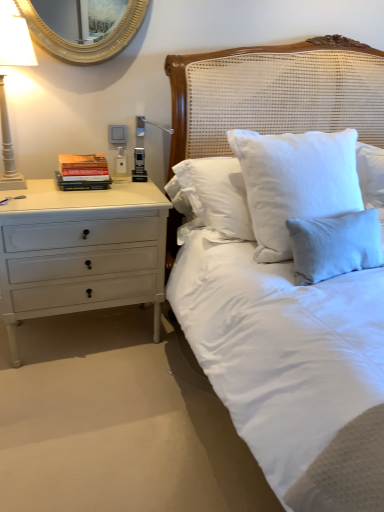
Question: From a real-world perspective, does white painted wood floor lamp at left sit lower than light blue linen pillow at upper right?

Choices:
 (A) no
 (B) yes

Answer: (A)

Question: From the image's perspective, would you say white painted wood floor lamp at left is shown under light blue linen pillow at upper right?

Choices:
 (A) no
 (B) yes

Answer: (A)

Question: Can you confirm if white painted wood floor lamp at left is shorter than light blue linen pillow at upper right?

Choices:
 (A) yes
 (B) no

Answer: (B)

Question: Is white painted wood floor lamp at left not close to light blue linen pillow at upper right?

Choices:
 (A) yes
 (B) no

Answer: (A)

Question: Considering the relative positions of white painted wood floor lamp at left and light blue linen pillow at upper right in the image provided, is white painted wood floor lamp at left to the right of light blue linen pillow at upper right from the viewer's perspective?

Choices:
 (A) no
 (B) yes

Answer: (A)

Question: Is hardcover books at left inside the boundaries of light blue linen pillow at upper right, or outside?

Choices:
 (A) outside
 (B) inside

Answer: (A)

Question: Considering the relative positions of hardcover books at left and light blue linen pillow at upper right in the image provided, is hardcover books at left to the left or to the right of light blue linen pillow at upper right?

Choices:
 (A) right
 (B) left

Answer: (B)

Question: In the image, is hardcover books at left positioned in front of or behind light blue linen pillow at upper right?

Choices:
 (A) behind
 (B) front

Answer: (A)

Question: From a real-world perspective, relative to light blue linen pillow at upper right, is hardcover books at left vertically above or below?

Choices:
 (A) below
 (B) above

Answer: (B)

Question: Considering the positions of white painted wood chest of drawers at left and white woven headboard at upper center in the image, is white painted wood chest of drawers at left bigger or smaller than white woven headboard at upper center?

Choices:
 (A) small
 (B) big

Answer: (B)

Question: In terms of height, does white painted wood chest of drawers at left look taller or shorter compared to white woven headboard at upper center?

Choices:
 (A) short
 (B) tall

Answer: (B)

Question: Choose the correct answer: Is white painted wood chest of drawers at left inside white woven headboard at upper center or outside it?

Choices:
 (A) inside
 (B) outside

Answer: (B)

Question: From a real-world perspective, relative to white woven headboard at upper center, is white painted wood chest of drawers at left vertically above or below?

Choices:
 (A) above
 (B) below

Answer: (B)

Question: Considering the positions of white painted wood chest of drawers at left and gold metallic mirror at upper left in the image, is white painted wood chest of drawers at left wider or thinner than gold metallic mirror at upper left?

Choices:
 (A) wide
 (B) thin

Answer: (A)

Question: From the image's perspective, is white painted wood chest of drawers at left positioned above or below gold metallic mirror at upper left?

Choices:
 (A) above
 (B) below

Answer: (B)